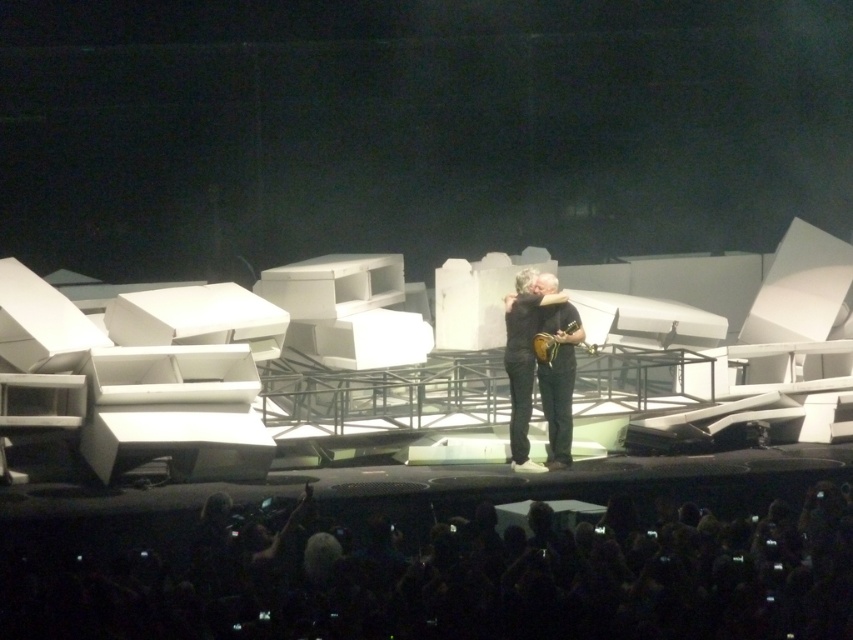
You are a stagehand standing at the back of the stage where the audience is. You need to retrieve the matte brown guitar at center for a quick equipment adjustment. Can you reach it without moving from your current position?

The matte brown guitar at center is 19.14 meters away from the viewer. Since you are at the back of the stage, this distance might be too far to reach the guitar without moving closer. You should move forward to access it.

You are a stagehand who needs to place a new microphone stand between the matte brown guitar at center and the gold metallic guitar at center. Given that the microphone stand requires 30 cm of space, can you determine if there is enough space between the two guitars?

The matte brown guitar at center is larger in size than the gold metallic guitar at center, but the exact distance between them isn not specified in the provided information. Therefore, it is impossible to determine if there is sufficient space for the microphone stand based solely on the given details.